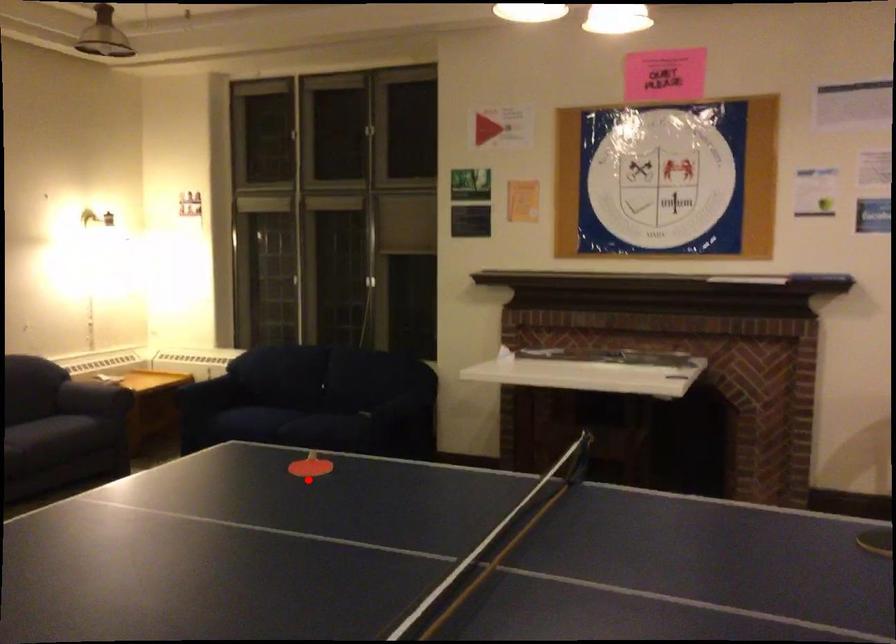
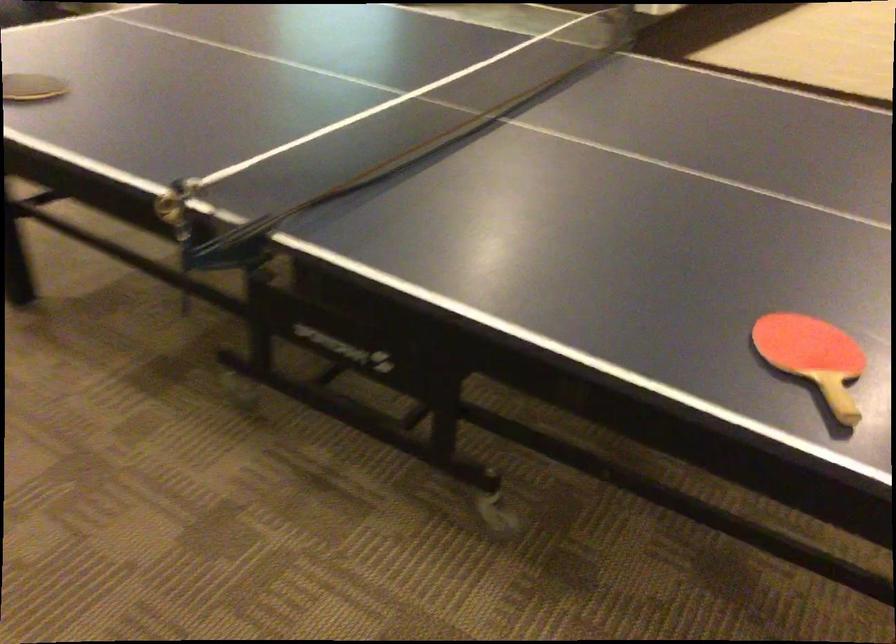
Find the pixel in the second image that matches the highlighted location in the first image.

(813, 357)